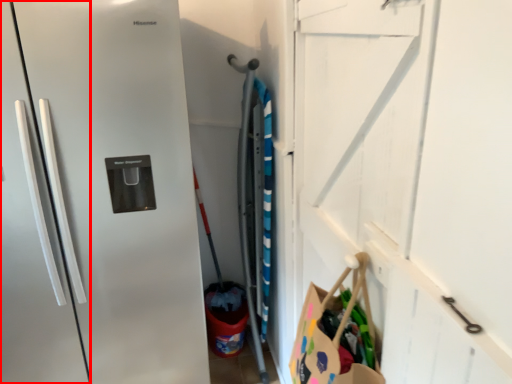
Question: Where is door (annotated by the red box) located in relation to garage door in the image?

Choices:
 (A) right
 (B) left

Answer: (B)